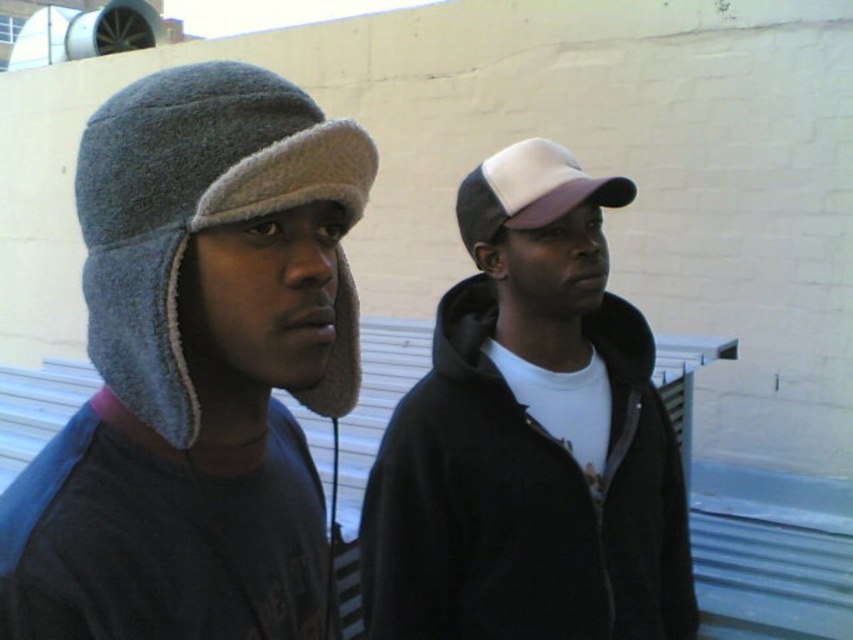
Which of these two, gray fleece hat at left or white mesh baseball cap at center, stands shorter?

white mesh baseball cap at center

Is point (204, 477) less distant than point (480, 172)?

Yes.

Identify the location of gray fleece hat at left. pyautogui.click(x=196, y=369).

Who is more forward, (131, 516) or (523, 296)?

Point (131, 516) is in front.

Can you confirm if gray fleece hat at left is positioned below white fabric cap at center?

→ No.

The image size is (853, 640). In order to click on gray fleece hat at left in this screenshot , I will do `click(196, 369)`.

Which of these two, white fabric cap at center or white mesh baseball cap at center, stands shorter?

Standing shorter between the two is white mesh baseball cap at center.

Can you confirm if white fabric cap at center is shorter than white mesh baseball cap at center?

Incorrect, white fabric cap at center's height does not fall short of white mesh baseball cap at center's.

You are a GUI agent. You are given a task and a screenshot of the screen. Output one action in this format:
    pyautogui.click(x=<x>, y=<y>)
    Task: Click on the white fabric cap at center
    
    Given the screenshot: What is the action you would take?
    pyautogui.click(x=531, y=436)

What are the coordinates of `white fabric cap at center` in the screenshot? It's located at (531, 436).